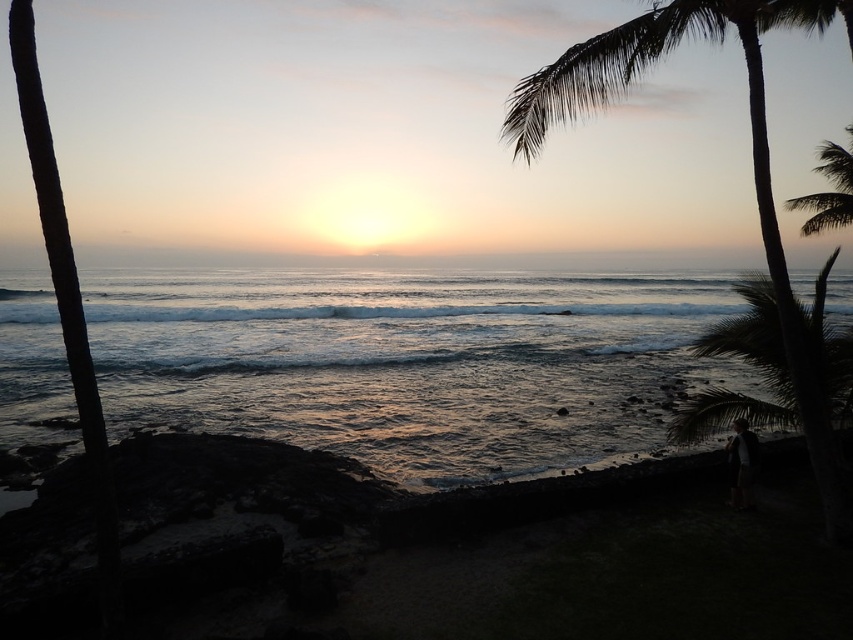
Question: Which of the following is the closest to the observer?

Choices:
 (A) silhouette leafy palm at upper right
 (B) green leafy palm tree at right

Answer: (B)

Question: Can you confirm if shiny blue water at center is positioned below smooth ocean at center?

Choices:
 (A) no
 (B) yes

Answer: (B)

Question: Does shiny blue water at center appear under green leafy palm tree at right?

Choices:
 (A) no
 (B) yes

Answer: (B)

Question: Observing the image, what is the correct spatial positioning of smooth ocean at center in reference to silhouette leafy palm at upper right?

Choices:
 (A) above
 (B) below

Answer: (A)

Question: Among these points, which one is farthest from the camera?

Choices:
 (A) (152, 314)
 (B) (782, 10)

Answer: (A)

Question: Which object is the closest to the green leafy palm tree at right?

Choices:
 (A) silhouette leafy palm at upper right
 (B) shiny blue water at center
 (C) smooth ocean at center

Answer: (B)